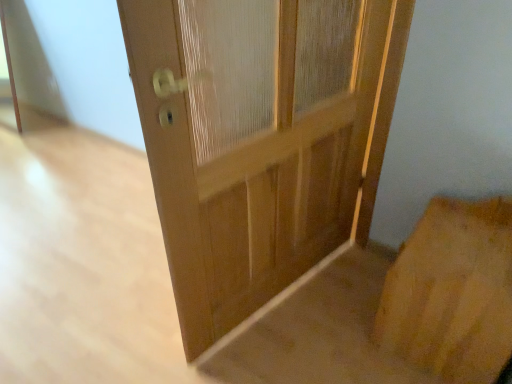
Question: Can you confirm if natural wood door at center is bigger than brown cardboard at lower right?

Choices:
 (A) no
 (B) yes

Answer: (B)

Question: From a real-world perspective, does natural wood door at center stand above brown cardboard at lower right?

Choices:
 (A) no
 (B) yes

Answer: (B)

Question: Is natural wood door at center to the left of brown cardboard at lower right from the viewer's perspective?

Choices:
 (A) yes
 (B) no

Answer: (A)

Question: Is natural wood door at center positioned with its back to brown cardboard at lower right?

Choices:
 (A) yes
 (B) no

Answer: (A)

Question: Considering the relative sizes of natural wood door at center and brown cardboard at lower right in the image provided, is natural wood door at center taller than brown cardboard at lower right?

Choices:
 (A) yes
 (B) no

Answer: (A)

Question: Is natural wood door at center not within brown cardboard at lower right?

Choices:
 (A) yes
 (B) no

Answer: (A)

Question: Are brown cardboard at lower right and natural wood door at center far apart?

Choices:
 (A) yes
 (B) no

Answer: (B)

Question: Is brown cardboard at lower right turned away from natural wood door at center?

Choices:
 (A) yes
 (B) no

Answer: (B)

Question: Can you confirm if brown cardboard at lower right is taller than natural wood door at center?

Choices:
 (A) no
 (B) yes

Answer: (A)

Question: Is brown cardboard at lower right aimed at natural wood door at center?

Choices:
 (A) no
 (B) yes

Answer: (B)

Question: Can you confirm if brown cardboard at lower right is smaller than natural wood door at center?

Choices:
 (A) no
 (B) yes

Answer: (B)

Question: From the image's perspective, is brown cardboard at lower right over natural wood door at center?

Choices:
 (A) no
 (B) yes

Answer: (A)

Question: From the image's perspective, is natural wood door at center above or below brown cardboard at lower right?

Choices:
 (A) below
 (B) above

Answer: (B)